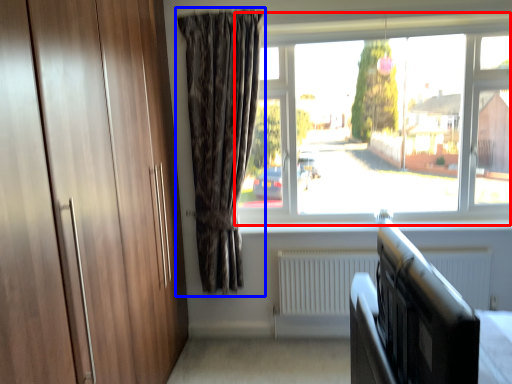
Question: Which object is further to the camera taking this photo, window (highlighted by a red box) or curtain (highlighted by a blue box)?

Choices:
 (A) window
 (B) curtain

Answer: (A)